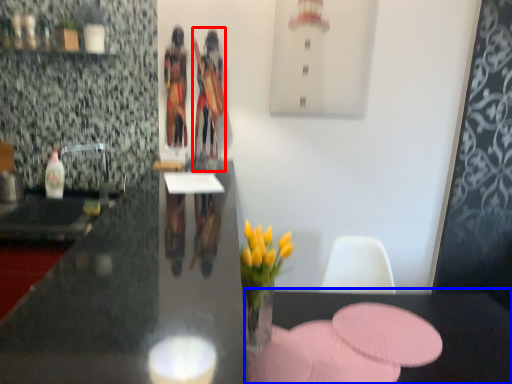
Question: Among these objects, which one is farthest to the camera, person (highlighted by a red box) or table (highlighted by a blue box)?

Choices:
 (A) person
 (B) table

Answer: (A)